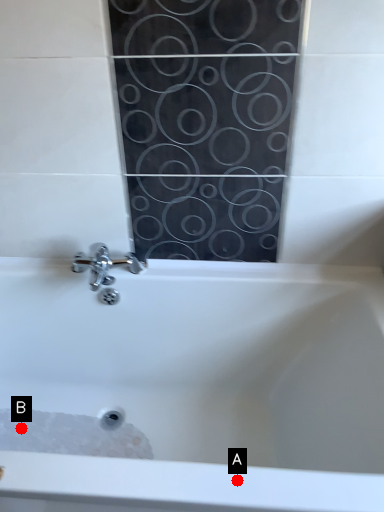
Question: Two points are circled on the image, labeled by A and B beside each circle. Among these points, which one is nearest to the camera?

Choices:
 (A) A is closer
 (B) B is closer

Answer: (A)